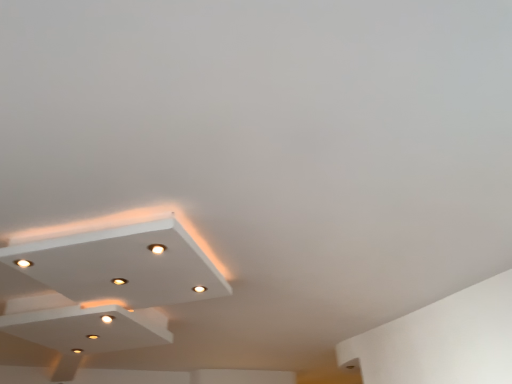
In order to click on matte white light at center in this screenshot , I will do `click(199, 289)`.

Identify the location of white matte exhaust hood at lower left. This screenshot has height=384, width=512. point(89,328).

Identify the location of droplight that appears in front of the matte white light at center. This screenshot has width=512, height=384. (157, 248).

From a real-world perspective, which is physically below, matte white light at center or matte white droplight at center?

matte white light at center, from a real-world perspective.

Is matte white light at center taller or shorter than matte white droplight at center?

matte white light at center is taller than matte white droplight at center.

Is matte white light at center wider or thinner than matte white droplight at center?

Clearly, matte white light at center has more width compared to matte white droplight at center.

Is matte white light at center at the back of white glossy ceiling light at lower left?

Yes, white glossy ceiling light at lower left is facing away from matte white light at center.

Is white glossy ceiling light at lower left surrounding matte white light at center?

Yes, matte white light at center can be found within white glossy ceiling light at lower left.

Does white glossy ceiling light at lower left appear on the right side of matte white light at center?

No.

Is point (227, 288) in front of point (205, 287)?

No, it is behind (205, 287).

Is matte white light at center looking in the opposite direction of white glossy ceiling light at lower left?

Yes, matte white light at center is positioned with its back facing white glossy ceiling light at lower left.

From the image's perspective, which one is positioned higher, matte white light at center or white glossy ceiling light at lower left?

white glossy ceiling light at lower left.

From a real-world perspective, who is located higher, matte white light at center or white glossy ceiling light at lower left?

In real-world perspective, white glossy ceiling light at lower left is above.

Is point (196, 286) positioned after point (180, 227)?

Yes.

Is white matte exhaust hood at lower left positioned beyond the bounds of matte white droplight at center?

Yes, white matte exhaust hood at lower left is not within matte white droplight at center.

Which is more to the right, white matte exhaust hood at lower left or matte white droplight at center?

matte white droplight at center.

Looking at this image, is white matte exhaust hood at lower left next to matte white droplight at center and touching it?

No, white matte exhaust hood at lower left is not with matte white droplight at center.

From the image's perspective, is matte white light at center located above or below white matte exhaust hood at lower left?

matte white light at center is situated higher than white matte exhaust hood at lower left in the image.

From a real-world perspective, is matte white light at center on top of white matte exhaust hood at lower left?

Yes, from a real-world perspective, matte white light at center is above white matte exhaust hood at lower left.

Does matte white light at center touch white matte exhaust hood at lower left?

No, matte white light at center is not in contact with white matte exhaust hood at lower left.

From a real-world perspective, between white matte exhaust hood at lower left and matte white light at center, who is vertically higher?

matte white light at center.

Considering the relative sizes of white matte exhaust hood at lower left and matte white light at center in the image provided, is white matte exhaust hood at lower left smaller than matte white light at center?

Actually, white matte exhaust hood at lower left might be larger than matte white light at center.

Consider the image. How different are the orientations of white matte exhaust hood at lower left and matte white light at center in degrees?

The angular difference between white matte exhaust hood at lower left and matte white light at center is 1.44 degrees.

Does white matte exhaust hood at lower left turn towards matte white light at center?

No, white matte exhaust hood at lower left does not turn towards matte white light at center.

What's the angular difference between white glossy ceiling light at lower left and matte white droplight at center's facing directions?

4.97 degrees separate the facing orientations of white glossy ceiling light at lower left and matte white droplight at center.

Which object is closer to the camera, white glossy ceiling light at lower left or matte white droplight at center?

white glossy ceiling light at lower left is more forward.

From a real-world perspective, does white glossy ceiling light at lower left stand above matte white droplight at center?

Yes, from a real-world perspective, white glossy ceiling light at lower left is over matte white droplight at center

Which is more to the right, white glossy ceiling light at lower left or matte white droplight at center?

From the viewer's perspective, matte white droplight at center appears more on the right side.

Where is `light to the right of matte white droplight at center`? The width and height of the screenshot is (512, 384). light to the right of matte white droplight at center is located at coordinates (199, 289).

Identify the location of lamp above the matte white light at center (from the image's perspective). (122, 265).

Estimate the real-world distances between objects in this image. Which object is closer to matte white light at center, matte white droplight at center or white glossy ceiling light at lower left?

white glossy ceiling light at lower left is closer to matte white light at center.

From the image, which object appears to be farther from white glossy ceiling light at lower left, white matte exhaust hood at lower left or matte white droplight at center?

Among the two, white matte exhaust hood at lower left is located further to white glossy ceiling light at lower left.

When comparing their distances from matte white droplight at center, does matte white light at center or white matte exhaust hood at lower left seem further?

Based on the image, white matte exhaust hood at lower left appears to be further to matte white droplight at center.

When comparing their distances from white matte exhaust hood at lower left, does matte white light at center or white glossy ceiling light at lower left seem closer?

white glossy ceiling light at lower left is positioned closer to the anchor white matte exhaust hood at lower left.

Looking at the image, which one is located closer to white glossy ceiling light at lower left, matte white droplight at center or white matte exhaust hood at lower left?

matte white droplight at center lies closer to white glossy ceiling light at lower left than the other object.

Looking at the image, which one is located closer to white glossy ceiling light at lower left, white matte exhaust hood at lower left or matte white light at center?

Based on the image, white matte exhaust hood at lower left appears to be nearer to white glossy ceiling light at lower left.

Looking at the image, which one is located further to matte white light at center, white glossy ceiling light at lower left or white matte exhaust hood at lower left?

white matte exhaust hood at lower left is further to matte white light at center.

Estimate the real-world distances between objects in this image. Which object is closer to matte white droplight at center, white matte exhaust hood at lower left or matte white light at center?

matte white light at center is closer to matte white droplight at center.

Identify the location of droplight between white glossy ceiling light at lower left and matte white light at center along the z-axis. (157, 248).

Where is `droplight located between white matte exhaust hood at lower left and matte white light at center in the left-right direction`? Image resolution: width=512 pixels, height=384 pixels. droplight located between white matte exhaust hood at lower left and matte white light at center in the left-right direction is located at coordinates (157, 248).

Identify the location of lamp that lies between matte white droplight at center and white matte exhaust hood at lower left from top to bottom. The image size is (512, 384). (122, 265).

Locate an element on the screen. This screenshot has height=384, width=512. lamp between white matte exhaust hood at lower left and matte white light at center from left to right is located at coordinates (122, 265).